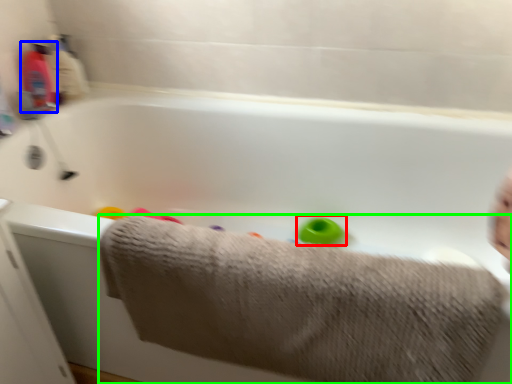
Question: Considering the real-world distances, which object is closest to toy (highlighted by a red box)? baby bottle (highlighted by a blue box) or towel (highlighted by a green box).

Choices:
 (A) baby bottle
 (B) towel

Answer: (B)